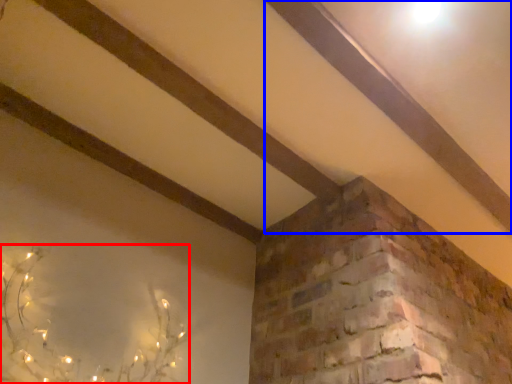
Question: Which of the following is the closest to the observer, plant (highlighted by a red box) or plank (highlighted by a blue box)?

Choices:
 (A) plant
 (B) plank

Answer: (A)